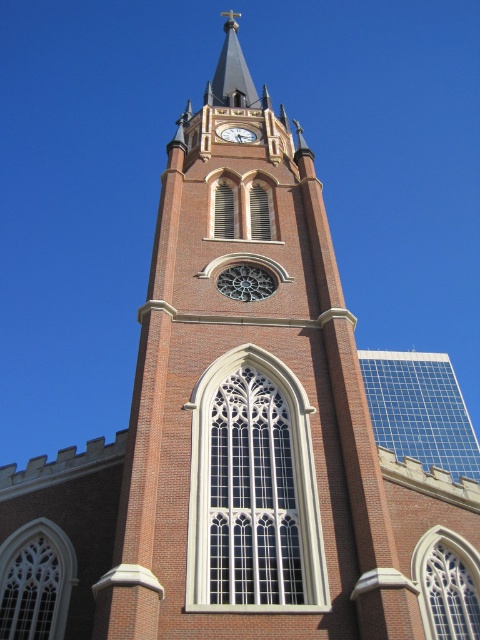
Question: Does smooth gray steeple at upper center lie in front of white glossy clock at upper center?

Choices:
 (A) yes
 (B) no

Answer: (B)

Question: Which of the following is the closest to the observer?

Choices:
 (A) (233, 19)
 (B) (238, 132)

Answer: (B)

Question: Is smooth gray steeple at upper center wider than white glossy clock at upper center?

Choices:
 (A) no
 (B) yes

Answer: (B)

Question: Among these objects, which one is farthest from the camera?

Choices:
 (A) white glossy clock at upper center
 (B) smooth gray steeple at upper center

Answer: (B)

Question: Considering the relative positions of smooth gray steeple at upper center and white glossy clock at upper center in the image provided, where is smooth gray steeple at upper center located with respect to white glossy clock at upper center?

Choices:
 (A) right
 (B) left

Answer: (B)